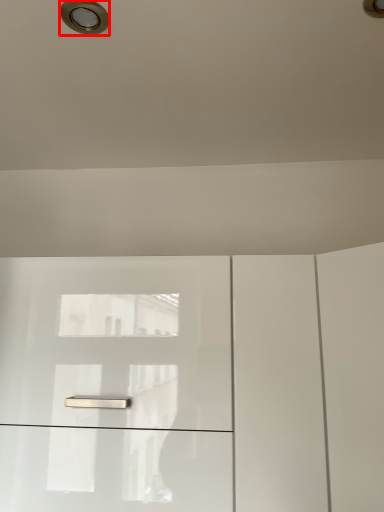
Question: In this image, where is droplight (annotated by the red box) located relative to dresser?

Choices:
 (A) left
 (B) right

Answer: (A)